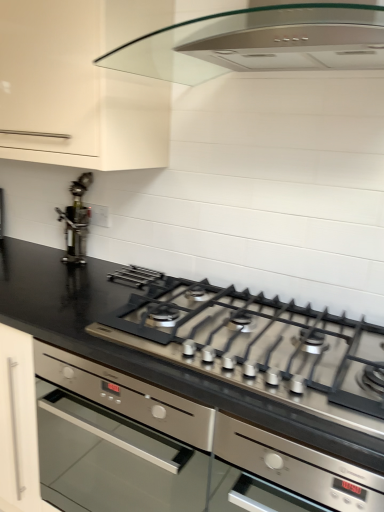
Question: Is stainless steel at left inside the boundaries of satin silver gas stove at center, or outside?

Choices:
 (A) outside
 (B) inside

Answer: (A)

Question: Is point (77, 226) closer or farther from the camera than point (349, 336)?

Choices:
 (A) farther
 (B) closer

Answer: (A)

Question: Estimate the real-world distances between objects in this image. Which object is farther from the matte white cabinet at upper left?

Choices:
 (A) stainless steel at left
 (B) black glossy countertop at center
 (C) satin silver gas stove at center

Answer: (C)

Question: Estimate the real-world distances between objects in this image. Which object is farther from the satin silver gas stove at center?

Choices:
 (A) black glossy countertop at center
 (B) matte white cabinet at upper left
 (C) stainless steel at left

Answer: (C)